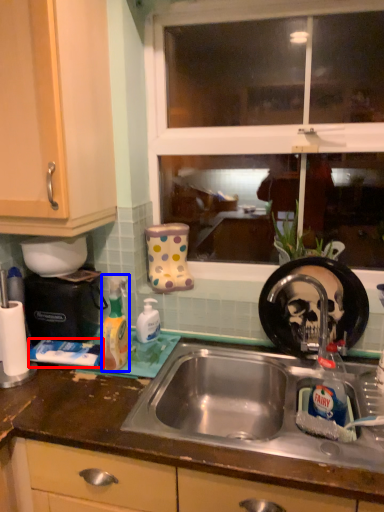
Question: Among these objects, which one is nearest to the camera, toothpaste (highlighted by a red box) or cleaning product (highlighted by a blue box)?

Choices:
 (A) toothpaste
 (B) cleaning product

Answer: (B)